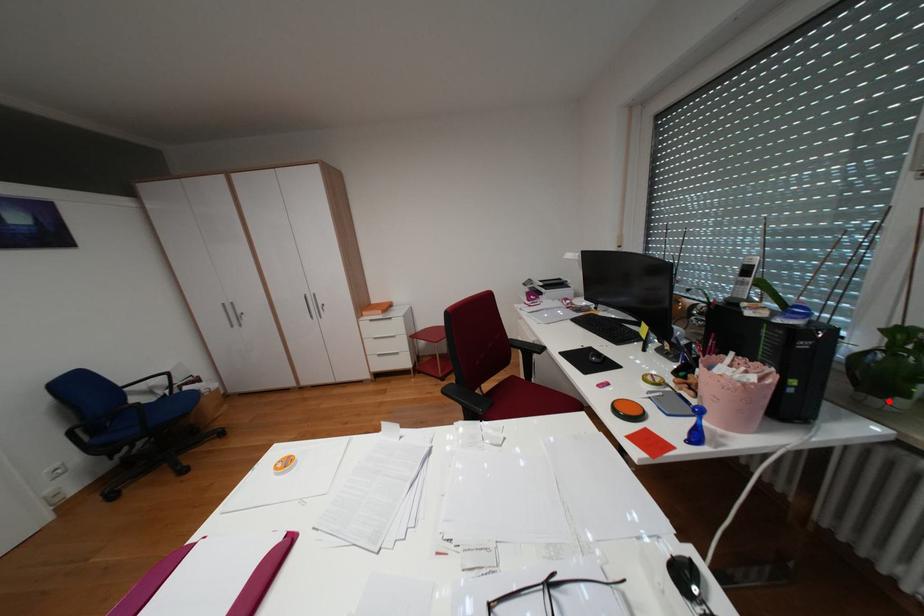
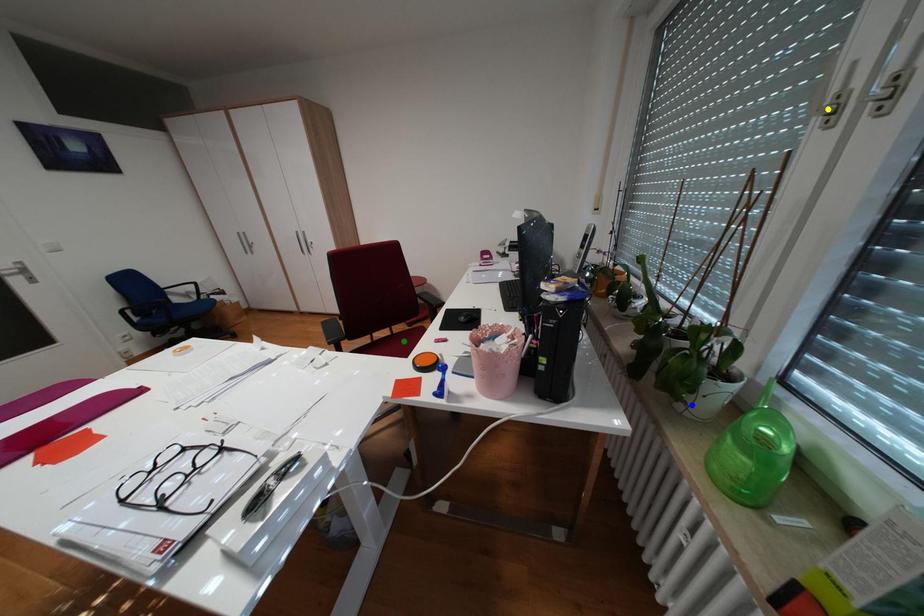
Question: I am providing you with two images of the same scene from different viewpoints. A red point is marked on the first image. You are given multiple points on the second image. Which mark in image 2 goes with the point in image 1?

Choices:
 (A) yellow point
 (B) blue point
 (C) green point

Answer: (B)